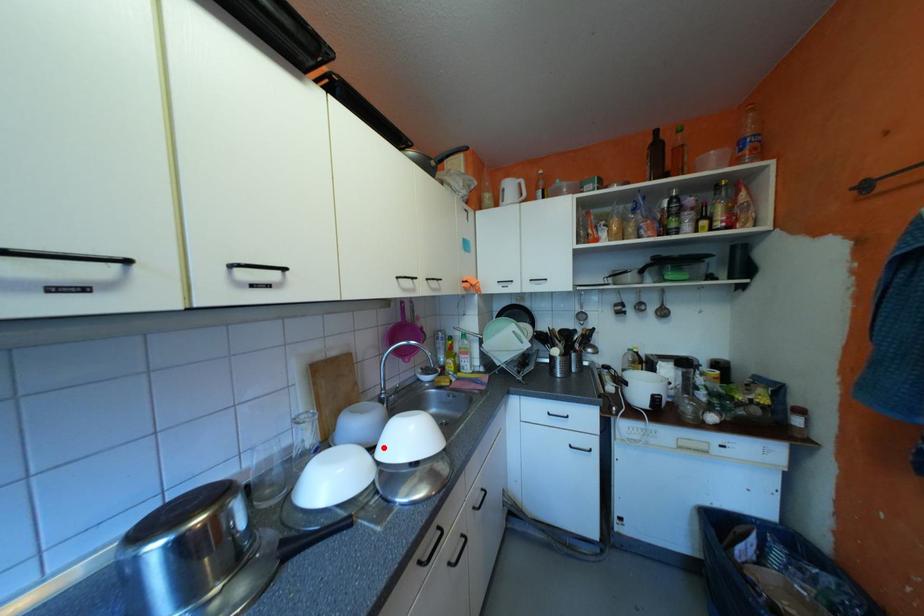
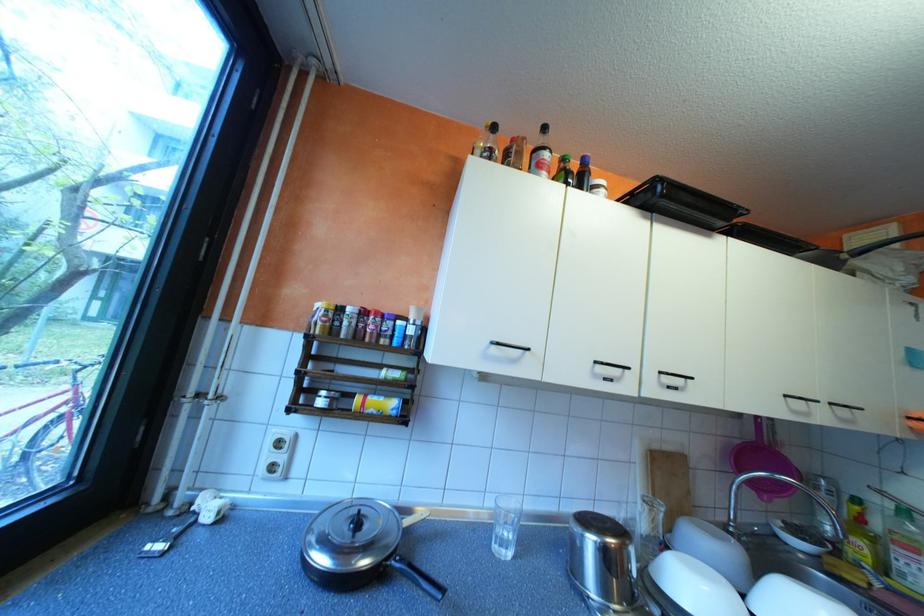
Question: I am providing you with two images of the same scene from different viewpoints. A red point is marked on the first image. At the location where the point appears in image 1, is it still visible in image 2?

Choices:
 (A) Yes
 (B) No

Answer: (A)